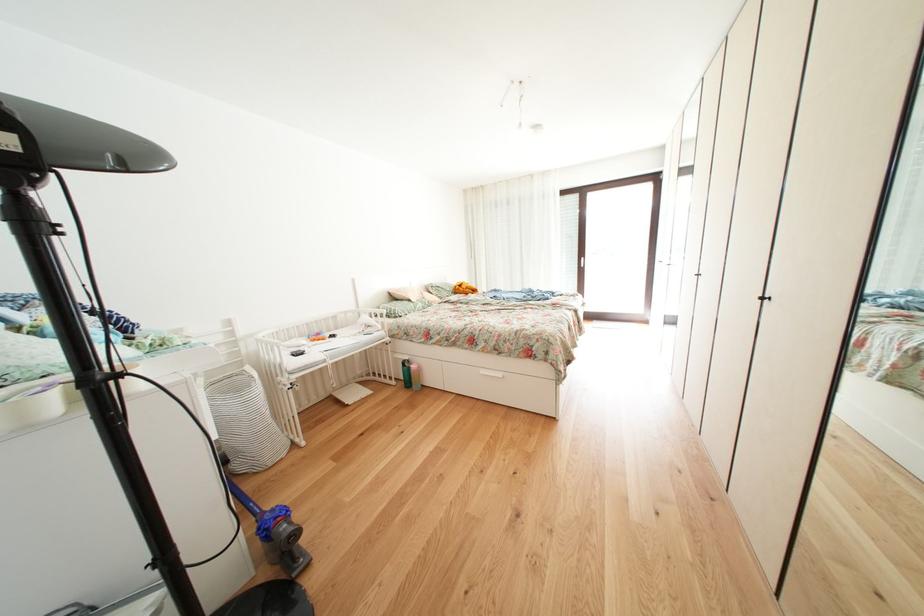
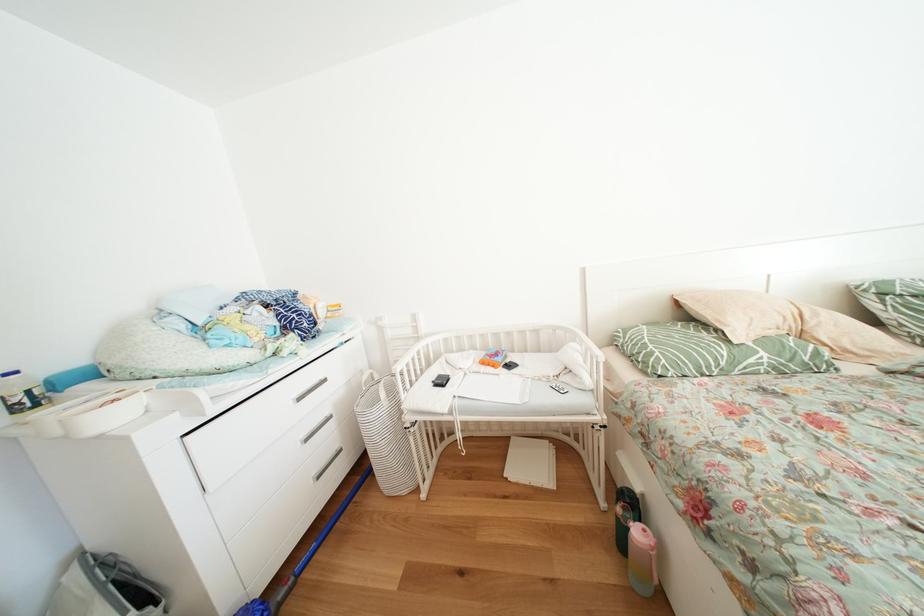
Locate, in the second image, the point that corresponds to pixel 315 342 in the first image.

(491, 360)